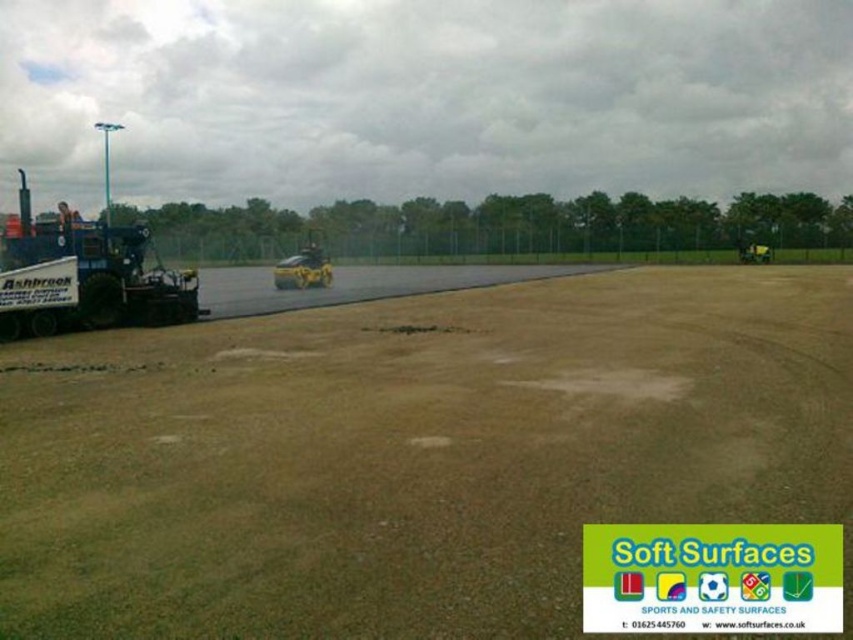
Can you confirm if brown sandy dirt field at center is bigger than blue metallic trailer truck at left?

Actually, brown sandy dirt field at center might be smaller than blue metallic trailer truck at left.

Who is more forward, (548,541) or (16,324)?

Positioned in front is point (548,541).

I want to click on brown sandy dirt field at center, so click(413, 454).

Can you confirm if brown sandy dirt field at center is positioned to the left of yellow rubber car at center?

No, brown sandy dirt field at center is not to the left of yellow rubber car at center.

Can you confirm if brown sandy dirt field at center is smaller than yellow rubber car at center?

Correct, brown sandy dirt field at center occupies less space than yellow rubber car at center.

Between point (438, 582) and point (287, 288), which one is positioned in front?

Point (438, 582) is more forward.

This screenshot has height=640, width=853. I want to click on brown sandy dirt field at center, so (x=413, y=454).

Which is more to the left, blue metallic trailer truck at left or yellow rubber car at center?

From the viewer's perspective, blue metallic trailer truck at left appears more on the left side.

Can you confirm if blue metallic trailer truck at left is wider than yellow rubber car at center?

Correct, the width of blue metallic trailer truck at left exceeds that of yellow rubber car at center.

Locate an element on the screen. The height and width of the screenshot is (640, 853). blue metallic trailer truck at left is located at coordinates (83, 276).